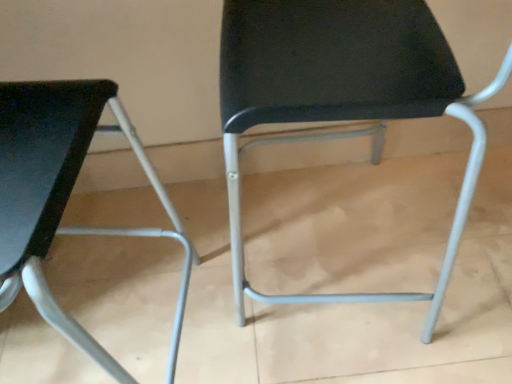
Find the location of `free area below matte black chair at left, which ranks as the first chair in left-to-right order (from a real-world perspective)`. free area below matte black chair at left, which ranks as the first chair in left-to-right order (from a real-world perspective) is located at coordinates (104, 327).